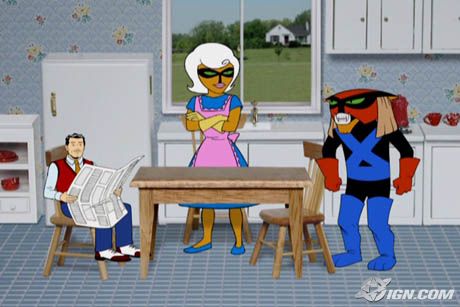
This screenshot has width=460, height=307. Find the location of `floor`. floor is located at coordinates (16, 258), (445, 253), (229, 284).